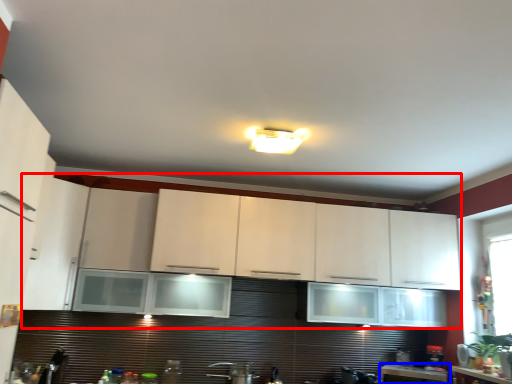
Question: Which object is further to the camera taking this photo, cabinetry (highlighted by a red box) or countertop (highlighted by a blue box)?

Choices:
 (A) cabinetry
 (B) countertop

Answer: (B)